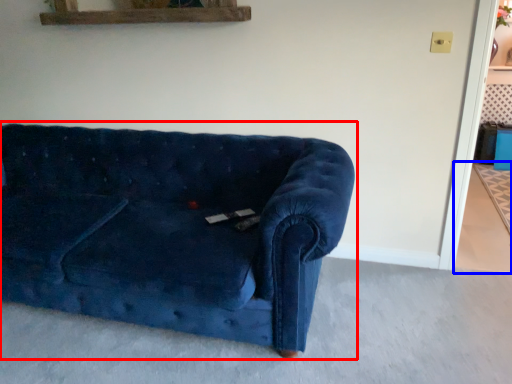
Question: Which point is further to the camera, studio couch (highlighted by a red box) or concrete (highlighted by a blue box)?

Choices:
 (A) studio couch
 (B) concrete

Answer: (B)